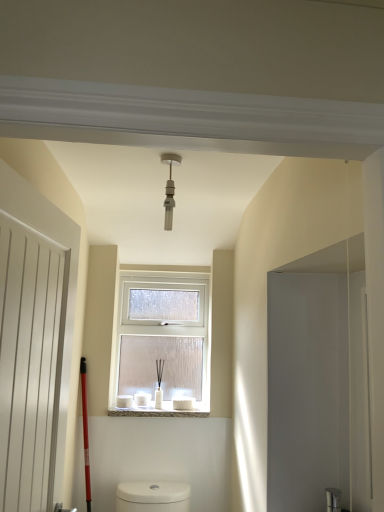
Question: Based on their positions, is white frosted glass window at center located to the left or right of white marble window sill at center?

Choices:
 (A) left
 (B) right

Answer: (B)

Question: From a real-world perspective, relative to white marble window sill at center, is white frosted glass window at center vertically above or below?

Choices:
 (A) below
 (B) above

Answer: (B)

Question: Which object is positioned closest to the white frosted glass window at center?

Choices:
 (A) white marble window sill at center
 (B) matte silver light fixture at center
 (C) white matte door at left

Answer: (A)

Question: Which object is the closest to the white frosted glass window at center?

Choices:
 (A) matte silver light fixture at center
 (B) white matte door at left
 (C) white marble window sill at center

Answer: (C)